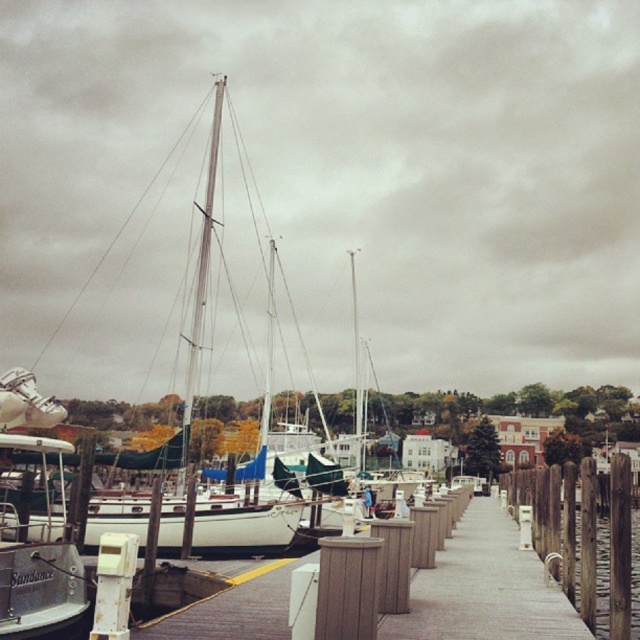
Question: Which point is closer to the camera?

Choices:
 (A) (3, 432)
 (B) (44, 424)

Answer: (A)

Question: Can you confirm if white matte sailboat at center is positioned above brushed metal boat at left?

Choices:
 (A) no
 (B) yes

Answer: (B)

Question: Which object is closer to the camera taking this photo?

Choices:
 (A) brushed metal boat at left
 (B) white matte sailboat at center

Answer: (A)

Question: From the image, what is the correct spatial relationship of white matte sailboat at center in relation to brushed metal boat at left?

Choices:
 (A) below
 (B) above

Answer: (B)

Question: Among these points, which one is nearest to the camera?

Choices:
 (A) (24, 464)
 (B) (346, 483)

Answer: (A)

Question: Does white matte sailboat at center appear over brushed metal boat at left?

Choices:
 (A) no
 (B) yes

Answer: (B)